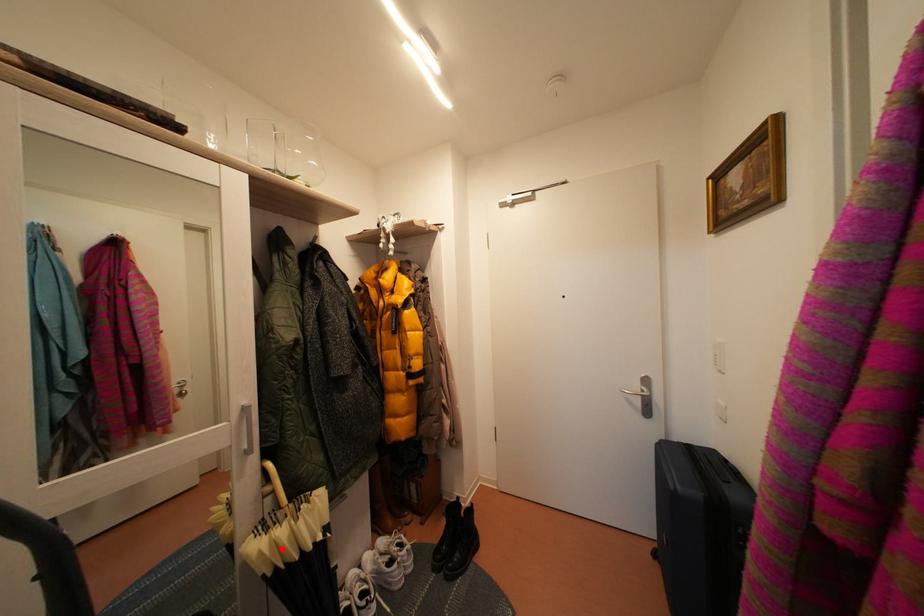
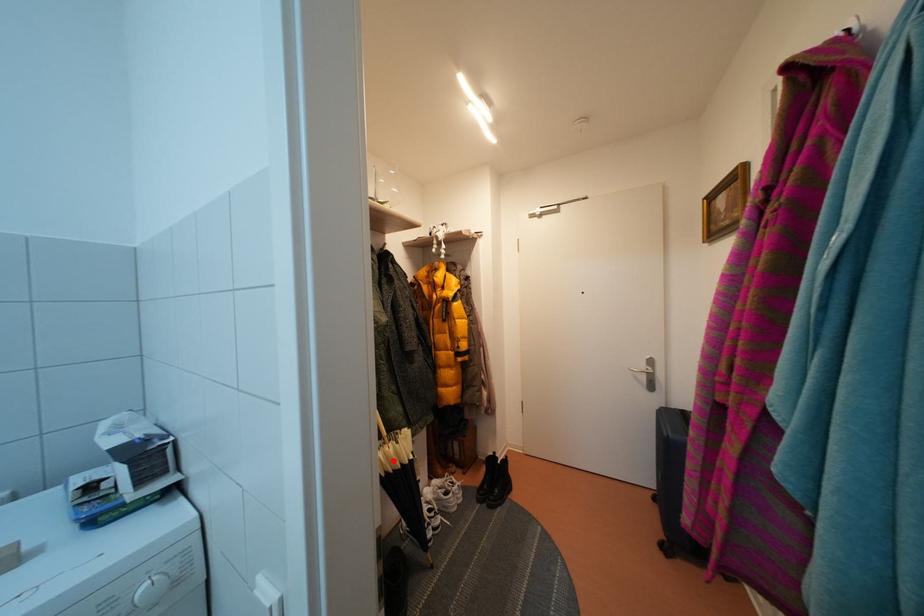
I am providing you with two images of the same scene from different viewpoints. A red point is marked on the first image and another point is marked on the second image. Are the points marked in image1 and image2 representing the same 3D position?

Yes